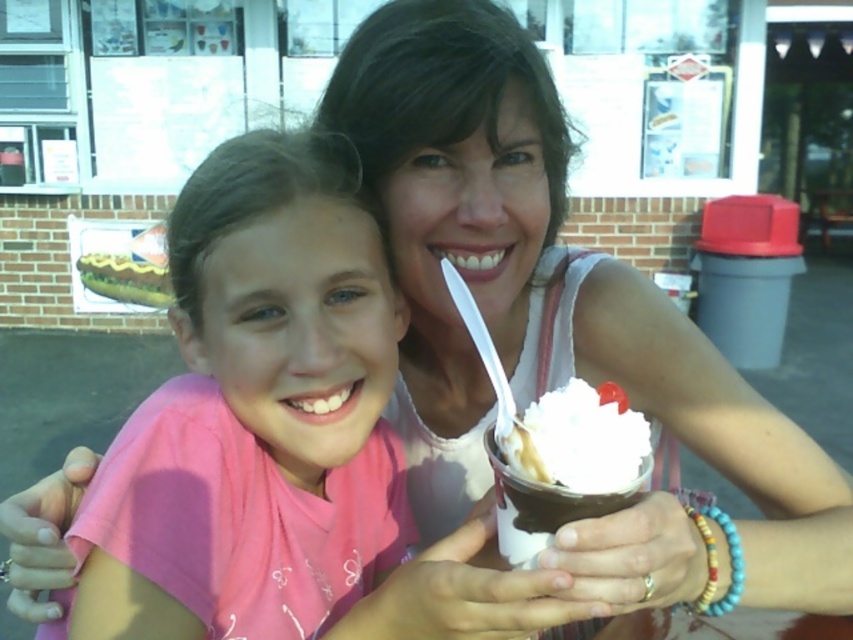
Which is below, pink fabric shirt at center or white creamy ice cream at center?

Positioned lower is white creamy ice cream at center.

Can you confirm if pink fabric shirt at center is positioned below white creamy ice cream at center?

No.

Is point (263, 433) farther from camera compared to point (511, 435)?

Yes, point (263, 433) is farther from viewer.

Where is `pink fabric shirt at center`? pink fabric shirt at center is located at coordinates (287, 300).